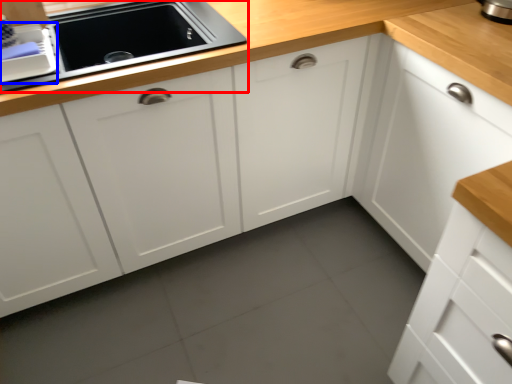
Question: Which object is further to the camera taking this photo, home appliance (highlighted by a red box) or appliance (highlighted by a blue box)?

Choices:
 (A) home appliance
 (B) appliance

Answer: (A)